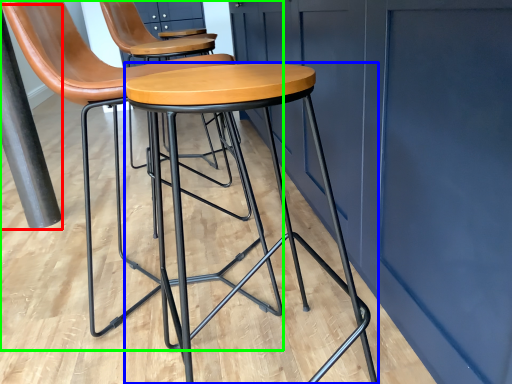
Question: Considering the real-world distances, which object is closest to pole (highlighted by a red box)? stool (highlighted by a blue box) or chair (highlighted by a green box).

Choices:
 (A) stool
 (B) chair

Answer: (B)